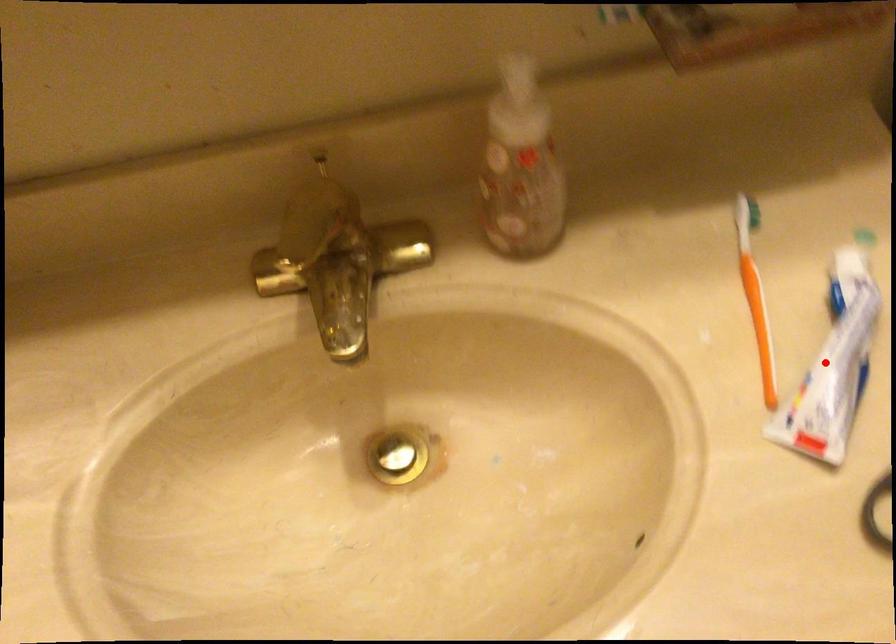
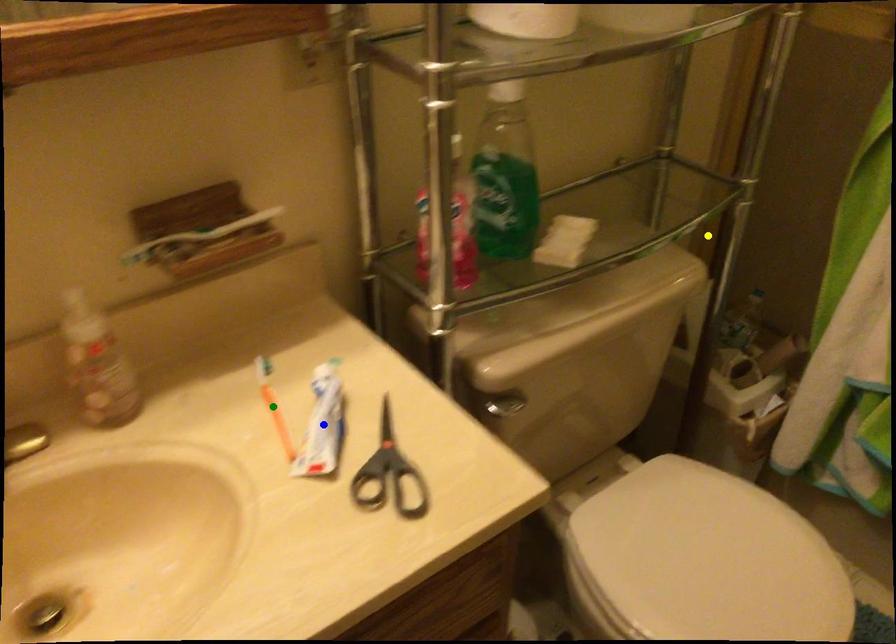
Question: I am providing you with two images of the same scene from different viewpoints. A red point is marked on the first image. You are given multiple points on the second image. In image 2, which mark is for the same physical point as the one in image 1?

Choices:
 (A) green point
 (B) blue point
 (C) yellow point

Answer: (B)